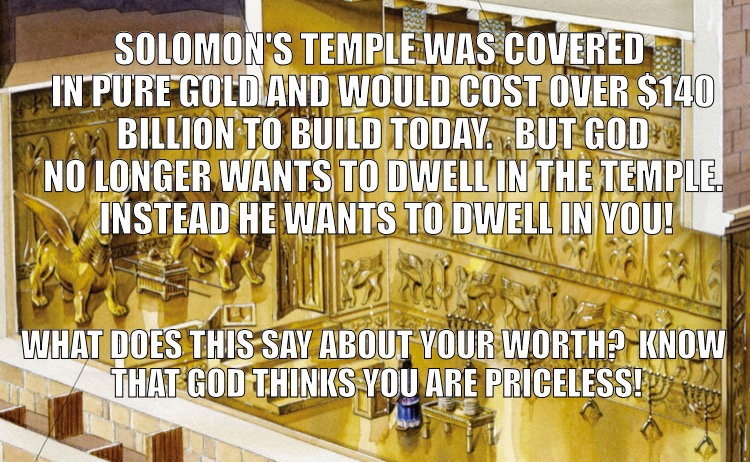
Find the location of a particular element. The image size is (750, 462). candelabra is located at coordinates (703, 411), (656, 420), (586, 413), (476, 325).